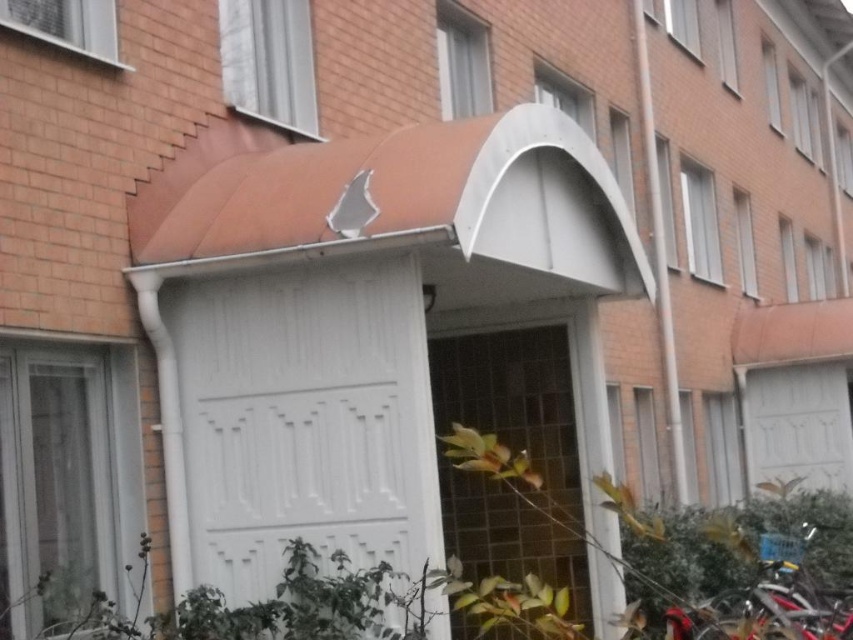
Does white painted wood garage door at center lie in front of shiny red bicycle at lower right?

Yes.

How much distance is there between white painted wood garage door at center and shiny red bicycle at lower right?

white painted wood garage door at center and shiny red bicycle at lower right are 10.35 feet apart.

Does point (213, 342) come farther from viewer compared to point (788, 582)?

No, it is in front of (788, 582).

Find the location of a particular element. Image resolution: width=853 pixels, height=640 pixels. white painted wood garage door at center is located at coordinates (305, 419).

Is white matte awning at center above shiny red bicycle at lower right?

Yes.

Consider the image. Does white matte awning at center have a larger size compared to shiny red bicycle at lower right?

Yes, white matte awning at center is bigger than shiny red bicycle at lower right.

Measure the distance between white matte awning at center and camera.

white matte awning at center is 19.60 feet away from camera.

What are the coordinates of `white matte awning at center` in the screenshot? It's located at (357, 323).

Is white matte awning at center to the left of white painted wood garage door at center from the viewer's perspective?

Incorrect, white matte awning at center is not on the left side of white painted wood garage door at center.

Can you confirm if white matte awning at center is smaller than white painted wood garage door at center?

No, white matte awning at center is not smaller than white painted wood garage door at center.

Does point (190, 234) come behind point (207, 490)?

No.

Locate an element on the screen. The image size is (853, 640). white matte awning at center is located at coordinates (357, 323).